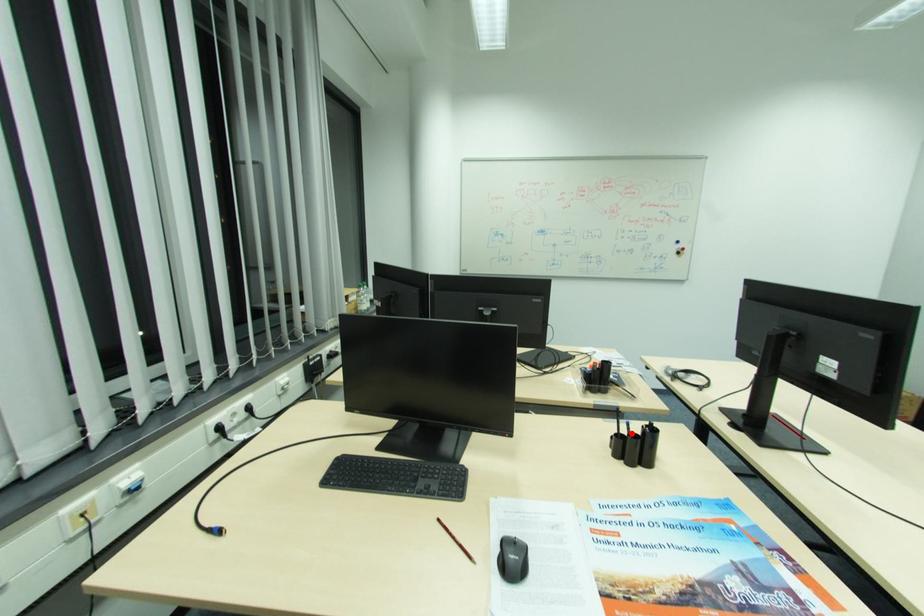
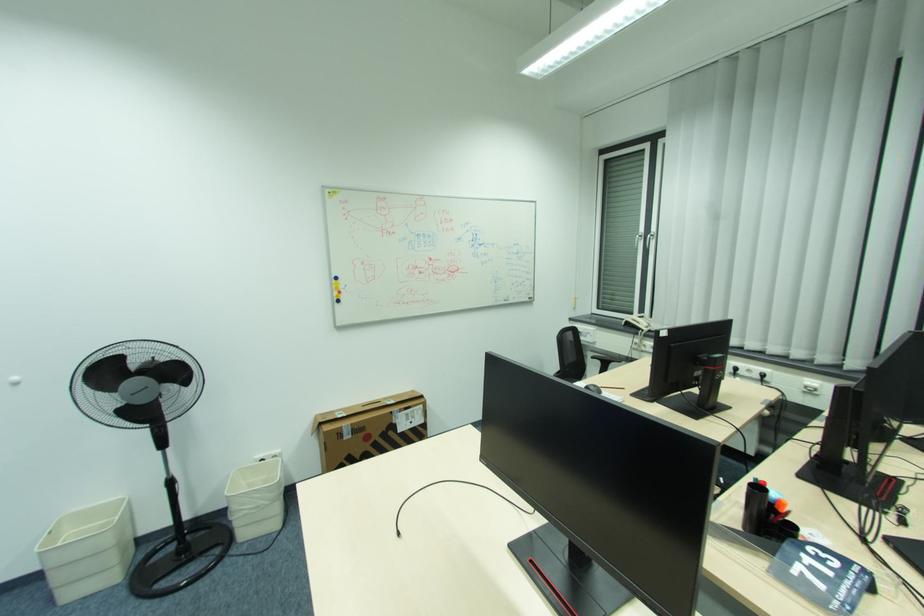
Question: I am providing you with two images of the same scene from different viewpoints. A red point is marked on the first image. Can you still see the location of the red point in image 2?

Choices:
 (A) Yes
 (B) No

Answer: (B)